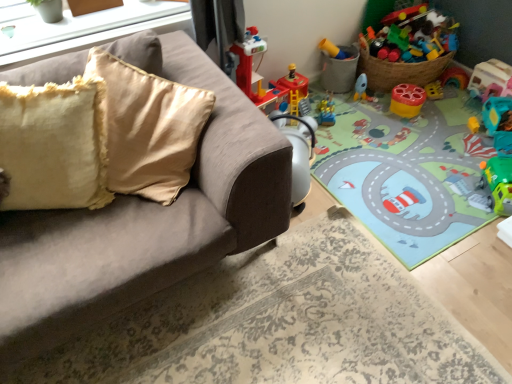
I want to click on vacant space that's between green plastic toy car at lower right, which is the 4th toy in left-to-right order, and translucent plastic toy at center, the 1th toy positioned from the left, so click(x=407, y=151).